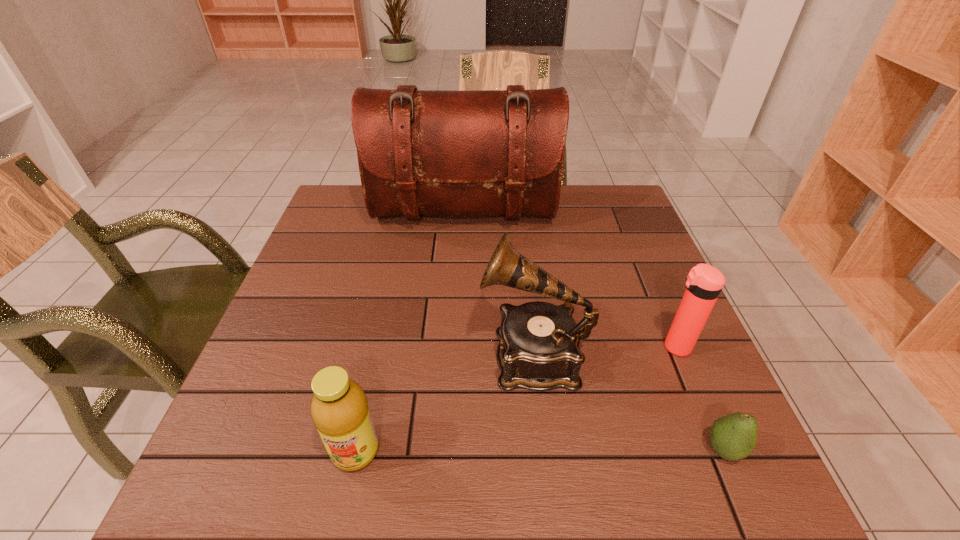
Where is `free space between the thermos bottle and the phonograph record`? The image size is (960, 540). free space between the thermos bottle and the phonograph record is located at coordinates (605, 351).

At what (x,y) coordinates should I click in order to perform the action: click on free spot between the tallest object and the shortest object. Please return your answer as a coordinate pair (x, y). This screenshot has height=540, width=960. Looking at the image, I should click on (593, 331).

At what (x,y) coordinates should I click in order to perform the action: click on vacant space in between the farthest object and the thermos bottle. Please return your answer as a coordinate pair (x, y). The height and width of the screenshot is (540, 960). Looking at the image, I should click on (569, 280).

Identify the location of empty location between the thermos bottle and the shortest object. (700, 399).

Find the location of a particular element. This screenshot has height=540, width=960. free space between the thermos bottle and the avocado is located at coordinates (700, 399).

At what (x,y) coordinates should I click in order to perform the action: click on free spot between the shortest object and the thermos bottle. Please return your answer as a coordinate pair (x, y). The width and height of the screenshot is (960, 540). Looking at the image, I should click on (700, 399).

Locate an element on the screen. empty space that is in between the phonograph record and the shortest object is located at coordinates (629, 402).

Identify the location of free space between the phonograph record and the thermos bottle. (605, 351).

Locate which object ranks in proximity to the tallest object. Please provide its 2D coordinates. Your answer should be formatted as a tuple, i.e. [(x, y)], where the tuple contains the x and y coordinates of a point satisfying the conditions above.

[(539, 350)]

Locate which object is the closest to the avocado. Please provide its 2D coordinates. Your answer should be formatted as a tuple, i.e. [(x, y)], where the tuple contains the x and y coordinates of a point satisfying the conditions above.

[(704, 282)]